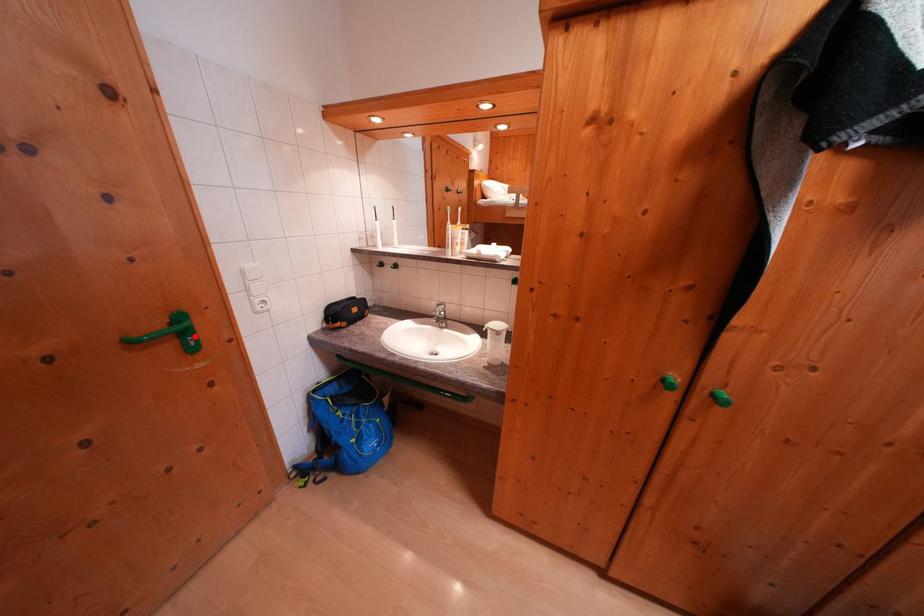
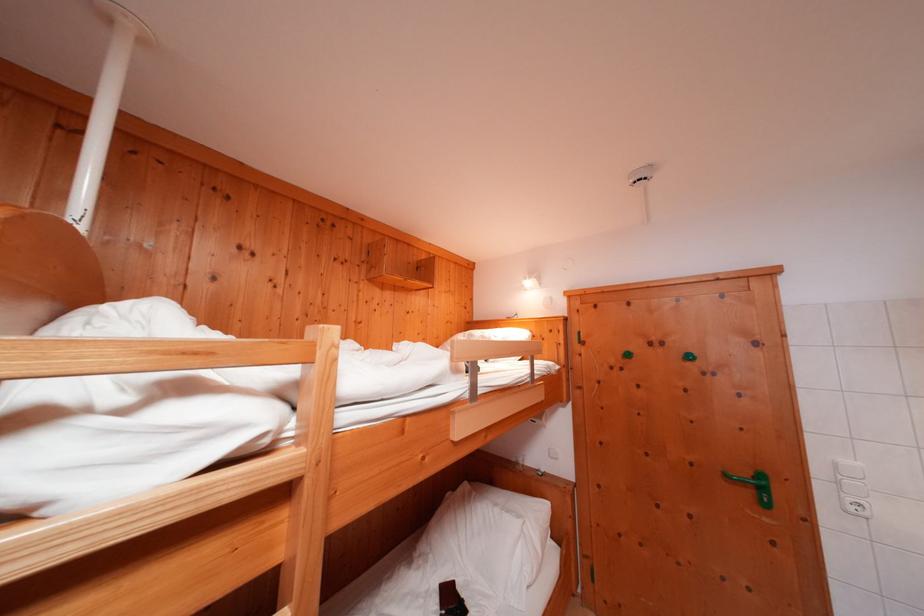
Where in the second image is the point corresponding to the highlighted location from the first image?

(771, 493)